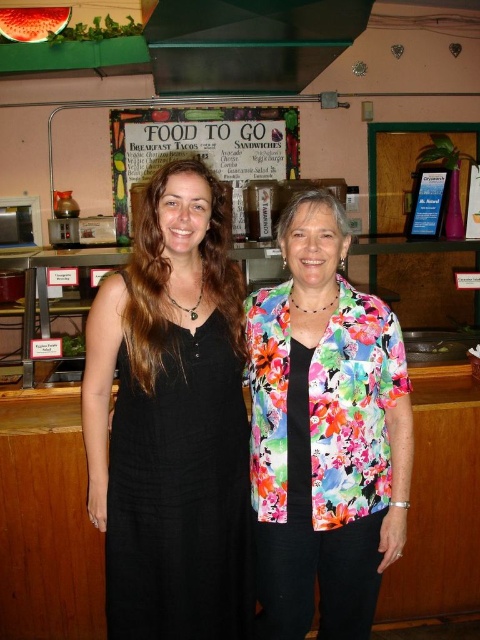
Does floral fabric blouse at center have a greater height compared to white paperboard at upper center?

Yes.

In the scene shown: Is floral fabric blouse at center smaller than white paperboard at upper center?

Yes, floral fabric blouse at center is smaller than white paperboard at upper center.

Image resolution: width=480 pixels, height=640 pixels. Describe the element at coordinates (324, 433) in the screenshot. I see `floral fabric blouse at center` at that location.

Where is `floral fabric blouse at center`? The height and width of the screenshot is (640, 480). floral fabric blouse at center is located at coordinates tap(324, 433).

Locate an element on the screen. The height and width of the screenshot is (640, 480). black cotton dress at center is located at coordinates (170, 420).

Is black cotton dress at center shorter than floral fabric blouse at center?

No.

Measure the distance between black cotton dress at center and camera.

black cotton dress at center and camera are 4.55 feet apart.

Locate an element on the screen. The height and width of the screenshot is (640, 480). black cotton dress at center is located at coordinates (170, 420).

Consider the image. Does black cotton dress at center have a greater height compared to white paperboard at upper center?

Yes, black cotton dress at center is taller than white paperboard at upper center.

Is black cotton dress at center positioned in front of white paperboard at upper center?

Yes, black cotton dress at center is in front of white paperboard at upper center.

Is point (92, 404) positioned in front of point (204, 112)?

Yes, it is in front of point (204, 112).

I want to click on black cotton dress at center, so click(170, 420).